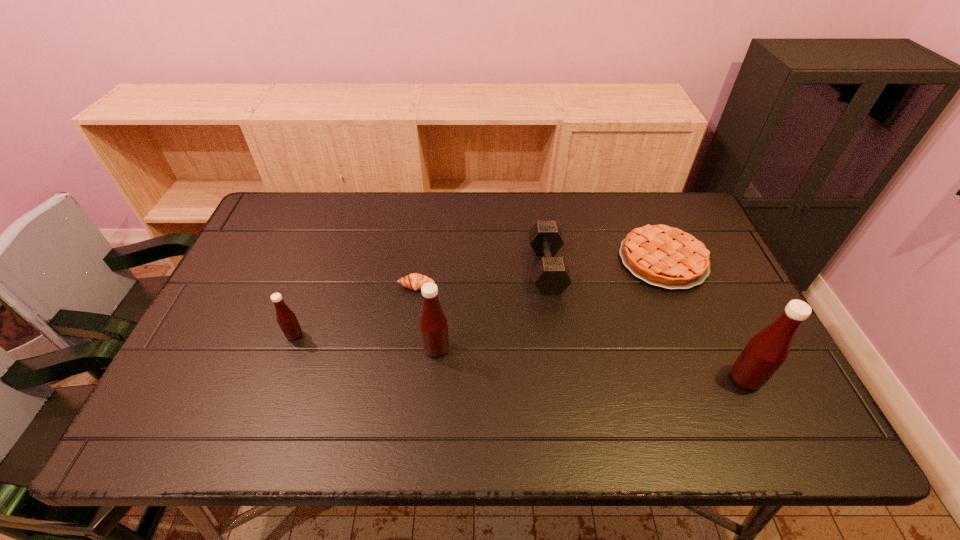
Locate an element on the screen. The width and height of the screenshot is (960, 540). the leftmost object is located at coordinates (286, 318).

Locate an element on the screen. The height and width of the screenshot is (540, 960). the shortest Tabasco sauce is located at coordinates (286, 318).

This screenshot has width=960, height=540. I want to click on the second tallest Tabasco sauce, so click(433, 323).

Where is `the fifth shortest object`? This screenshot has height=540, width=960. the fifth shortest object is located at coordinates (433, 323).

This screenshot has height=540, width=960. Identify the location of the nearest Tabasco sauce. (766, 351).

The width and height of the screenshot is (960, 540). Find the location of `the rightmost Tabasco sauce`. the rightmost Tabasco sauce is located at coordinates (766, 351).

You are a GUI agent. You are given a task and a screenshot of the screen. Output one action in this format:
    pyautogui.click(x=<x>, y=<y>)
    Task: Click on the pie
    The height and width of the screenshot is (540, 960).
    Given the screenshot: What is the action you would take?
    pyautogui.click(x=663, y=256)

The image size is (960, 540). Identify the location of dumbbell. (551, 275).

The image size is (960, 540). In order to click on the fourth object from left to right in this screenshot , I will do `click(551, 275)`.

Identify the location of pastry. (415, 281).